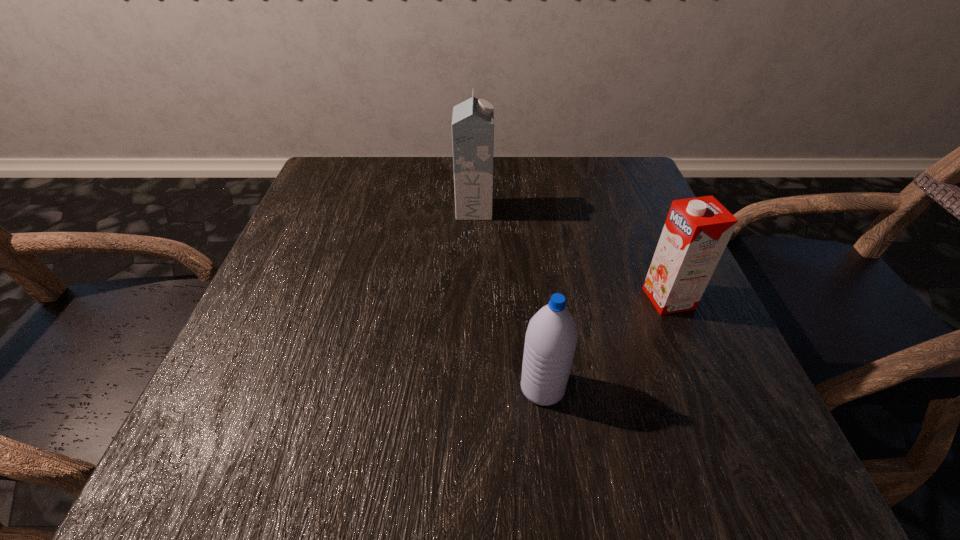
The width and height of the screenshot is (960, 540). I want to click on the farther carton, so click(x=473, y=120).

Where is `the left carton`? The height and width of the screenshot is (540, 960). the left carton is located at coordinates (473, 120).

You are a GUI agent. You are given a task and a screenshot of the screen. Output one action in this format:
    pyautogui.click(x=<x>, y=<y>)
    Task: Click on the nearer carton
    The image size is (960, 540).
    Given the screenshot: What is the action you would take?
    pyautogui.click(x=697, y=230)

Image resolution: width=960 pixels, height=540 pixels. What are the coordinates of `the right carton` in the screenshot? It's located at (697, 230).

I want to click on the nearest object, so click(x=551, y=337).

This screenshot has width=960, height=540. I want to click on water bottle, so click(x=551, y=337).

The width and height of the screenshot is (960, 540). Find the location of `vacant area situated 0.180m on the front label of the leftmost object`. vacant area situated 0.180m on the front label of the leftmost object is located at coordinates (572, 210).

Find the location of a particular element. vacant space located on the back of the second nearest object is located at coordinates (649, 251).

Locate an element on the screen. The width and height of the screenshot is (960, 540). free location located on the back of the second object from left to right is located at coordinates (529, 271).

At what (x,y) coordinates should I click in order to perform the action: click on object present at the far edge. Please return your answer as a coordinate pair (x, y). Looking at the image, I should click on (473, 120).